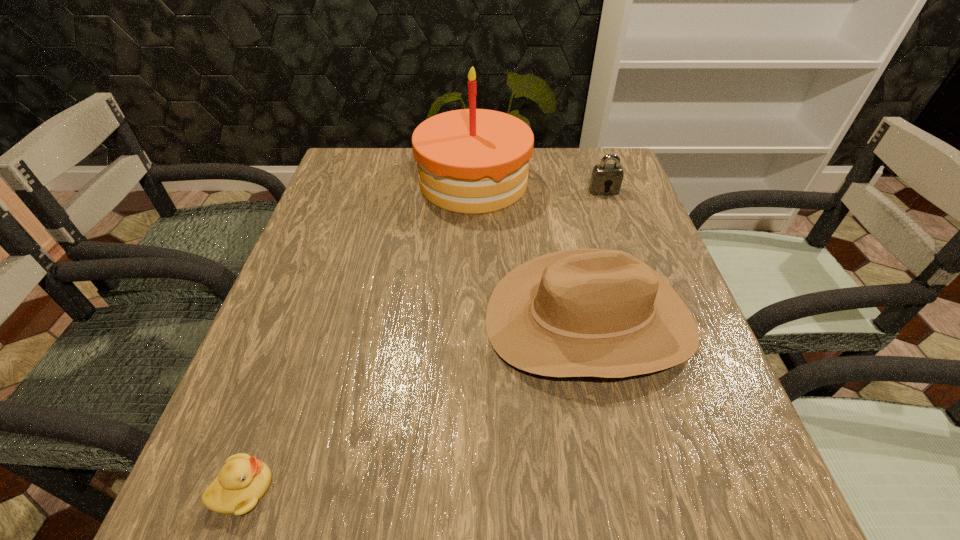
Locate an element on the screen. The image size is (960, 540). vacant space at the left edge is located at coordinates (376, 218).

In the image, there is a desktop. Where is `vacant space at the right edge`? This screenshot has height=540, width=960. vacant space at the right edge is located at coordinates (603, 220).

In the image, there is a desktop. Where is `vacant space at the near left corner`? The width and height of the screenshot is (960, 540). vacant space at the near left corner is located at coordinates (306, 497).

In the image, there is a desktop. At what (x,y) coordinates should I click in order to perform the action: click on free space at the near right corner. Please return your answer as a coordinate pair (x, y). This screenshot has height=540, width=960. Looking at the image, I should click on (724, 531).

Identify the location of vacant area that lies between the birthday cake and the padlock. This screenshot has height=540, width=960. (539, 186).

Locate an element on the screen. unoccupied position between the shortest object and the birthday cake is located at coordinates (358, 335).

Where is `free space between the cowboy hat and the leftmost object`? This screenshot has width=960, height=540. free space between the cowboy hat and the leftmost object is located at coordinates (417, 404).

Find the location of a particular element. free space between the third tallest object and the birthday cake is located at coordinates (539, 186).

Identify the location of vacant point located between the leftmost object and the third farthest object. The width and height of the screenshot is (960, 540). (417, 404).

At what (x,y) coordinates should I click in order to perform the action: click on vacant area that lies between the duckling and the birthday cake. Please return your answer as a coordinate pair (x, y). The height and width of the screenshot is (540, 960). Looking at the image, I should click on (358, 335).